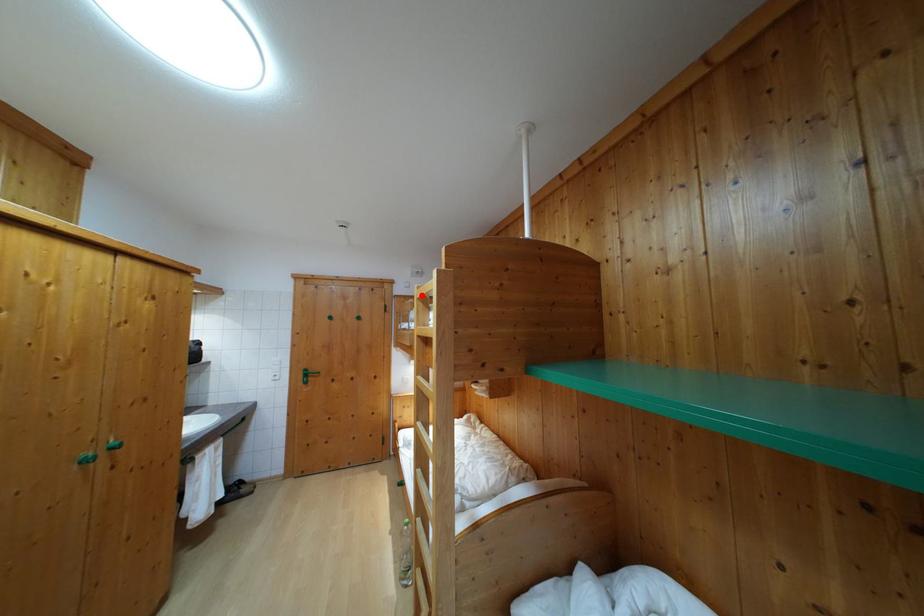
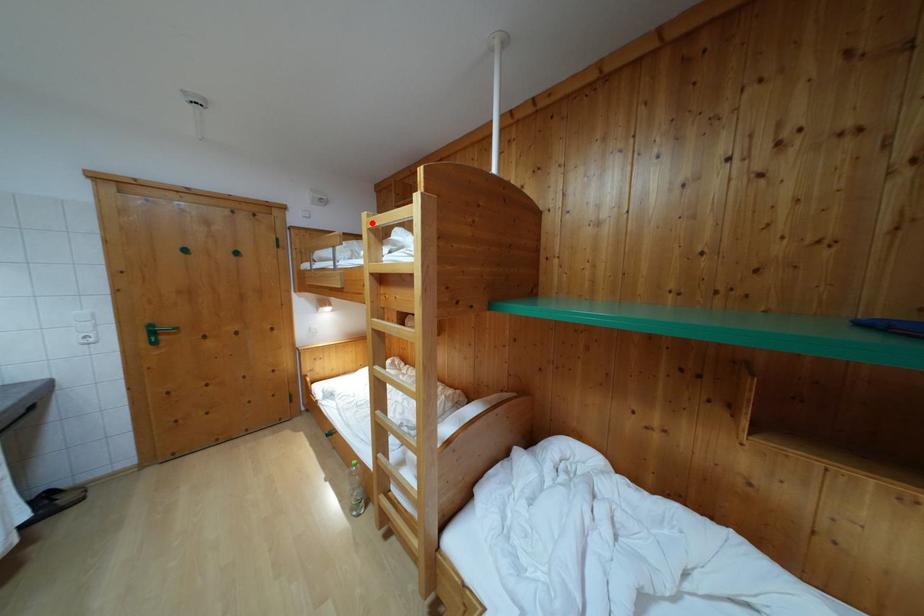
I am providing you with two images of the same scene from different viewpoints. A red point is marked on the first image and another point is marked on the second image. Is the marked point in image1 the same physical position as the marked point in image2?

Yes